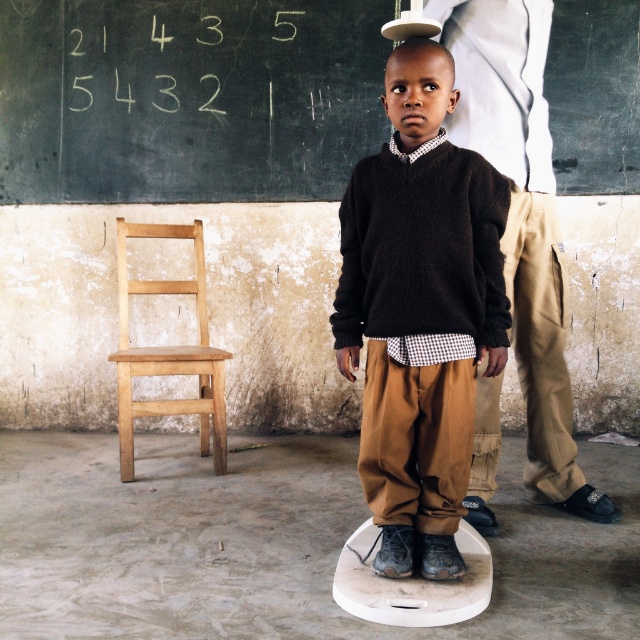
Question: Can you confirm if black chalkboard at upper center is positioned above white plastic stool at center?

Choices:
 (A) no
 (B) yes

Answer: (B)

Question: Which point appears farthest from the camera in this image?

Choices:
 (A) (280, 54)
 (B) (460, 596)
 (C) (154, 227)
 (D) (38, 170)

Answer: (D)

Question: Which point is farther from the camera taking this photo?

Choices:
 (A) (76, 45)
 (B) (458, 602)
 (C) (428, 140)

Answer: (A)

Question: Is white chalk numbers at upper center thinner than white plastic stool at center?

Choices:
 (A) no
 (B) yes

Answer: (A)

Question: Based on their relative distances, which object is nearer to the white plastic stool at center?

Choices:
 (A) light brown wooden chair at left
 (B) black chalkboard at upper center

Answer: (A)

Question: Is white chalk numbers at upper center positioned behind white plastic stool at center?

Choices:
 (A) no
 (B) yes

Answer: (B)